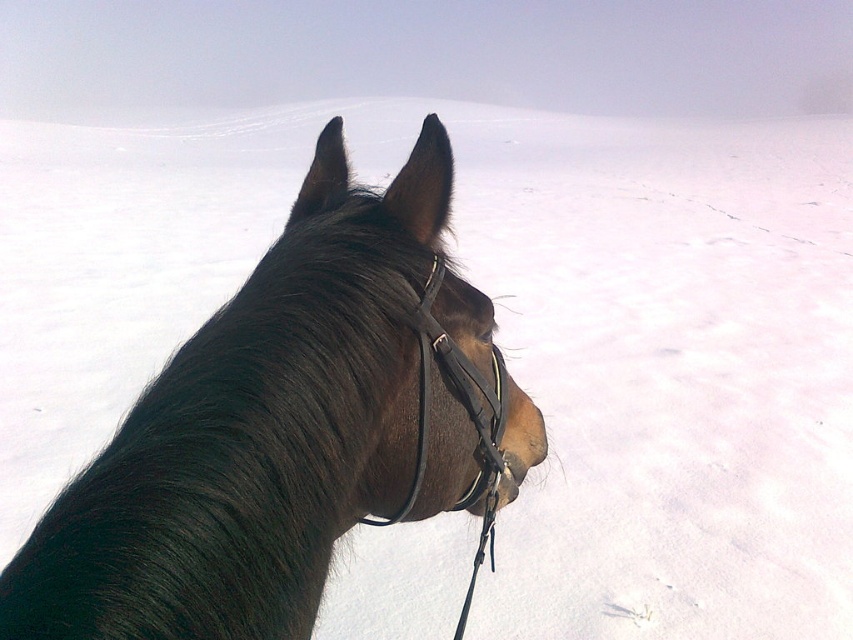
Is shiny brown horse at center positioned in front of black leather bridle at center?

Yes, it is in front of black leather bridle at center.

Can you confirm if shiny brown horse at center is shorter than black leather bridle at center?

Incorrect, shiny brown horse at center's height does not fall short of black leather bridle at center's.

Does point (13, 561) come in front of point (434, 289)?

Yes, it is in front of point (434, 289).

Where is `shiny brown horse at center`? Image resolution: width=853 pixels, height=640 pixels. shiny brown horse at center is located at coordinates (289, 428).